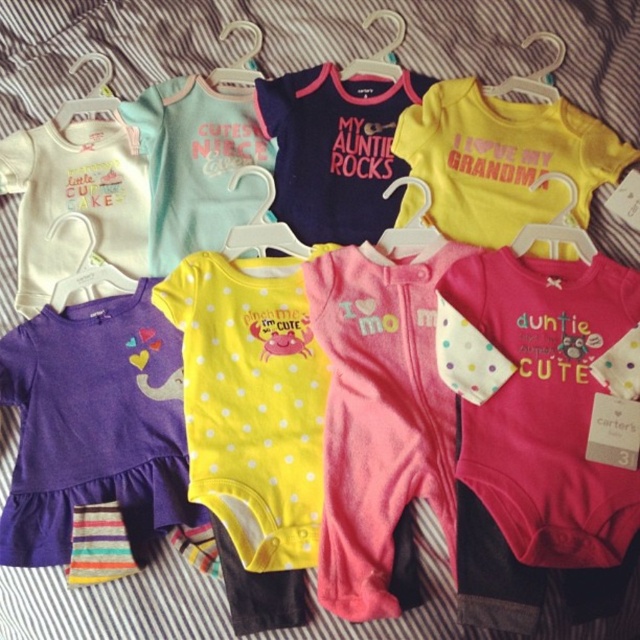
Question: Estimate the real-world distances between objects in this image. Which object is farther from the white matte bib at upper left?

Choices:
 (A) pink fleece onesie at center-right
 (B) matte pink onesie at center
 (C) yellow polka dot onesie at center

Answer: (A)

Question: Which of the following is the farthest from the observer?

Choices:
 (A) (262, 129)
 (B) (636, 406)
 (C) (369, 320)

Answer: (A)

Question: Is matte pink onesie at center thinner than white matte bib at upper left?

Choices:
 (A) no
 (B) yes

Answer: (A)

Question: Which of the following is the farthest from the observer?

Choices:
 (A) pink fleece onesie at center
 (B) purple soft fabric dress at lower left
 (C) matte pink onesie at center

Answer: (C)

Question: Is pink fleece onesie at center below matte pink onesie at center?

Choices:
 (A) no
 (B) yes

Answer: (B)

Question: Is matte pink onesie at center above white matte bib at upper left?

Choices:
 (A) yes
 (B) no

Answer: (A)